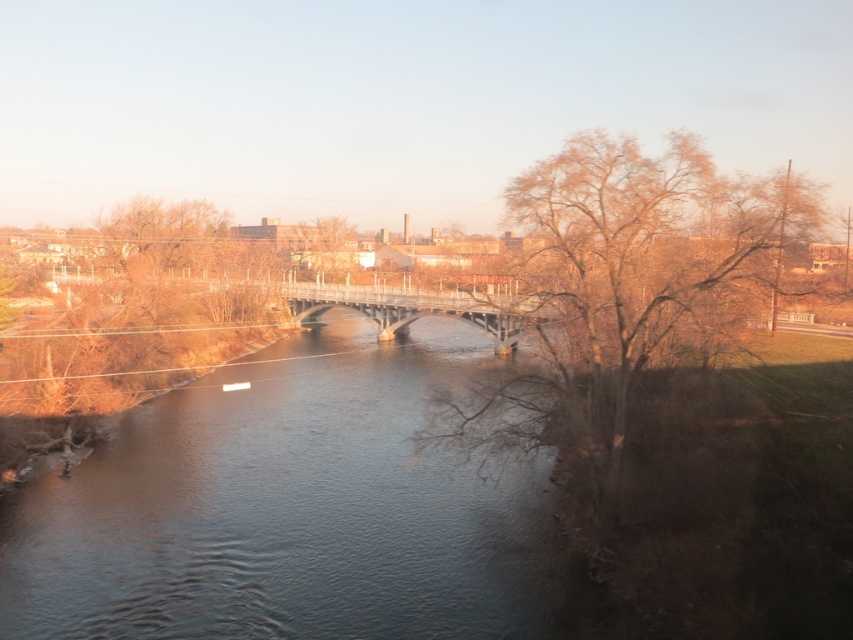
Question: Which point is farther to the camera?

Choices:
 (A) concrete gray bridge at center
 (B) brown leafless tree at right
 (C) brown leafless tree at center

Answer: (C)

Question: Which point is closer to the camera?

Choices:
 (A) [256, 611]
 (B) [380, 289]
 (C) [616, 250]
 (D) [331, 241]

Answer: (A)

Question: Does dark blue water at center have a greater width compared to brown leafless tree at right?

Choices:
 (A) yes
 (B) no

Answer: (A)

Question: Is dark blue water at center above brown leafless tree at center?

Choices:
 (A) yes
 (B) no

Answer: (B)

Question: Which object appears farthest from the camera in this image?

Choices:
 (A) brown leafless tree at center
 (B) concrete gray bridge at center
 (C) dark blue water at center

Answer: (A)

Question: Is concrete gray bridge at center in front of brown leafless tree at center?

Choices:
 (A) yes
 (B) no

Answer: (A)